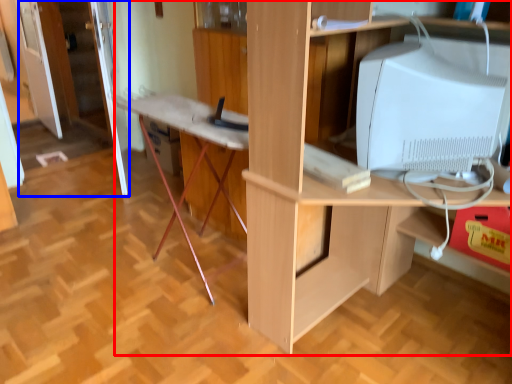
Question: Which point is further to the camera, desk (highlighted by a red box) or door (highlighted by a blue box)?

Choices:
 (A) desk
 (B) door

Answer: (B)